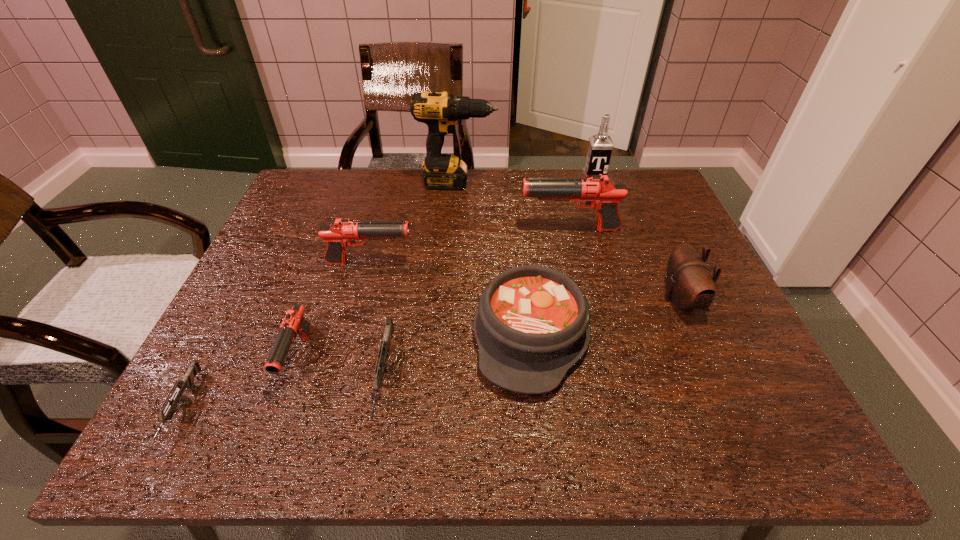
Identify which gun is the closest to the rightmost object. Please provide its 2D coordinates. Your answer should be formatted as a tuple, i.e. [(x, y)], where the tuple contains the x and y coordinates of a point satisfying the conditions above.

[(599, 191)]

Find the location of a particular element. The height and width of the screenshot is (540, 960). black gun that is the third nearest to the casserole is located at coordinates (294, 323).

Image resolution: width=960 pixels, height=540 pixels. I want to click on black gun that is the closest one to the leftmost object, so click(294, 323).

The width and height of the screenshot is (960, 540). I want to click on vacant space that satisfies the following two spatial constraints: 1. with the flap open on the brown pouch; 2. on the front side of the gray casserole, so point(695,334).

Image resolution: width=960 pixels, height=540 pixels. Identify the location of free spot that satisfies the following two spatial constraints: 1. with the flap open on the rightmost object; 2. aimed along the barrel of the shortest object. (729, 409).

Where is `free space that satisfies the following two spatial constraints: 1. on the front label of the second tallest object; 2. at the tip of the black drill`? The width and height of the screenshot is (960, 540). free space that satisfies the following two spatial constraints: 1. on the front label of the second tallest object; 2. at the tip of the black drill is located at coordinates (597, 183).

You are a GUI agent. You are given a task and a screenshot of the screen. Output one action in this format:
    pyautogui.click(x=<x>, y=<y>)
    Task: Click on the vacant position in the image that satisfies the following two spatial constraints: 1. on the front label of the second tallest object; 2. at the aiming end of the rightmost gun
    This screenshot has width=960, height=540.
    Given the screenshot: What is the action you would take?
    613,230

At what (x,y) coordinates should I click in order to perform the action: click on blank space that satisfies the following two spatial constraints: 1. at the tip of the black drill; 2. at the aiming end of the nearest black gun. Please return your answer as a coordinate pair (x, y). Looking at the image, I should click on (445, 359).

Where is `vacant space that satisfies the following two spatial constraints: 1. at the tip of the drill; 2. at the aiming end of the nearest black gun`? The height and width of the screenshot is (540, 960). vacant space that satisfies the following two spatial constraints: 1. at the tip of the drill; 2. at the aiming end of the nearest black gun is located at coordinates (445, 359).

At what (x,y) coordinates should I click in order to perform the action: click on free location that satisfies the following two spatial constraints: 1. on the front label of the vodka; 2. at the tip of the black drill. Please return your answer as a coordinate pair (x, y). Looking at the image, I should click on (597, 183).